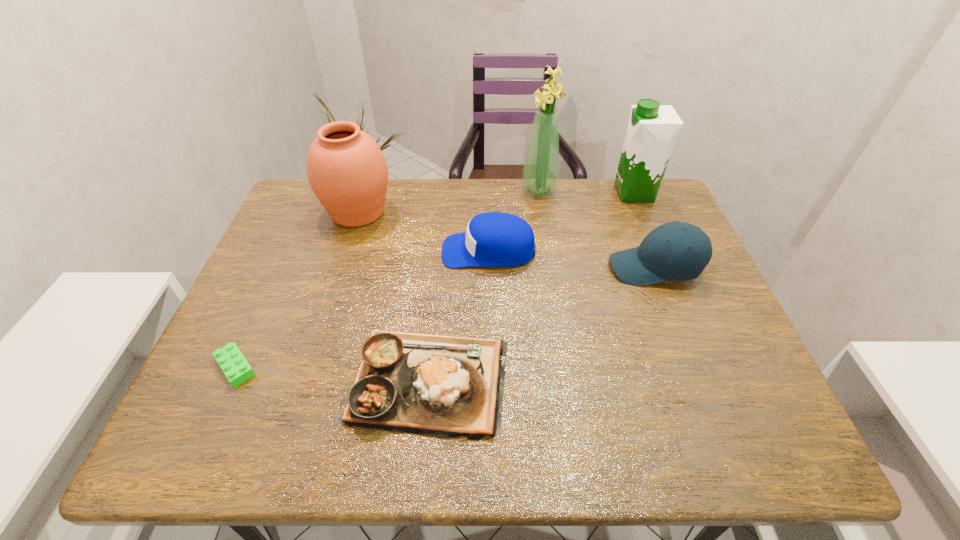
You are a GUI agent. You are given a task and a screenshot of the screen. Output one action in this format:
    pyautogui.click(x=<x>, y=<y>)
    Task: Click on the vacant space located 0.160m on the front-facing side of the tallest object
    This screenshot has width=960, height=540.
    Given the screenshot: What is the action you would take?
    [471, 190]

At what (x,y) coordinates should I click in order to perform the action: click on free space located 0.390m on the front-facing side of the tallest object. Please return your answer as a coordinate pair (x, y). Looking at the image, I should click on (399, 190).

You are a GUI agent. You are given a task and a screenshot of the screen. Output one action in this format:
    pyautogui.click(x=<x>, y=<y>)
    Task: Click on the vacant space located on the front-facing side of the soya milk
    
    Given the screenshot: What is the action you would take?
    pyautogui.click(x=543, y=193)

Locate an element on the screen. vacant space located 0.350m on the front-facing side of the soya milk is located at coordinates (503, 193).

Where is `free space located on the front-facing side of the soya milk`? free space located on the front-facing side of the soya milk is located at coordinates (588, 193).

This screenshot has width=960, height=540. In order to click on vacant space situated 0.080m on the front of the urn in this screenshot , I will do `click(345, 254)`.

The image size is (960, 540). In order to click on vacant space located 0.170m on the front-facing side of the taller baseball cap in this screenshot , I will do `click(544, 268)`.

Locate an element on the screen. The height and width of the screenshot is (540, 960). vacant position located on the front-facing side of the taller baseball cap is located at coordinates (537, 268).

Locate an element on the screen. The image size is (960, 540). free space located 0.190m on the front-facing side of the taller baseball cap is located at coordinates (537, 268).

Find the location of a particular element. Image resolution: width=960 pixels, height=540 pixels. blank area located on the front-facing side of the fifth tallest object is located at coordinates (354, 251).